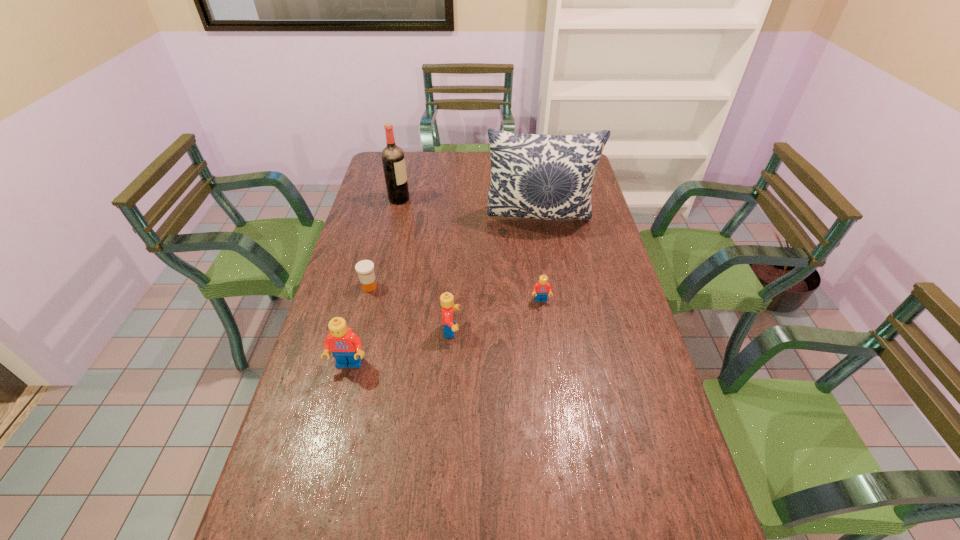
The image size is (960, 540). In the image, there is a desktop. In order to click on vacant space at the near edge in this screenshot , I will do coord(393,496).

In the image, there is a desktop. Find the location of `vacant region at the left edge`. vacant region at the left edge is located at coordinates (328, 443).

Find the location of a particular element. This screenshot has height=540, width=960. free space at the right edge of the desktop is located at coordinates (600, 274).

Find the location of a particular element. free space between the medicine and the nearest object is located at coordinates (359, 326).

Where is `vacant space in between the fourth tallest object and the farthest Lego`? vacant space in between the fourth tallest object and the farthest Lego is located at coordinates (496, 315).

Identify the location of free space between the third farthest object and the rightmost Lego. (455, 293).

I want to click on empty space between the medicine and the nearest Lego, so click(x=359, y=326).

Locate an element on the screen. The image size is (960, 540). vacant space that is in between the fifth farthest object and the leftmost Lego is located at coordinates (400, 347).

This screenshot has width=960, height=540. I want to click on empty space that is in between the third farthest object and the liquor, so click(x=384, y=243).

This screenshot has height=540, width=960. I want to click on free space between the second nearest object and the liquor, so click(425, 265).